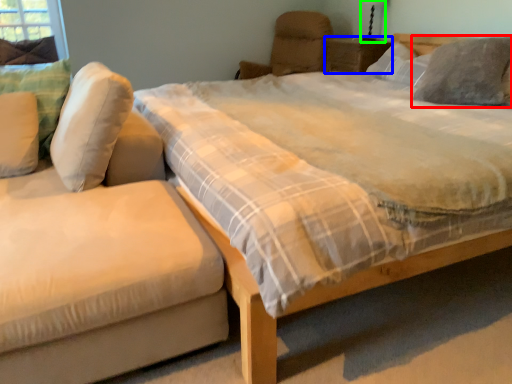
Question: Based on their relative distances, which object is nearer to pillow (highlighted by a red box)? Choose from nightstand (highlighted by a blue box) and table lamp (highlighted by a green box).

Choices:
 (A) nightstand
 (B) table lamp

Answer: (A)